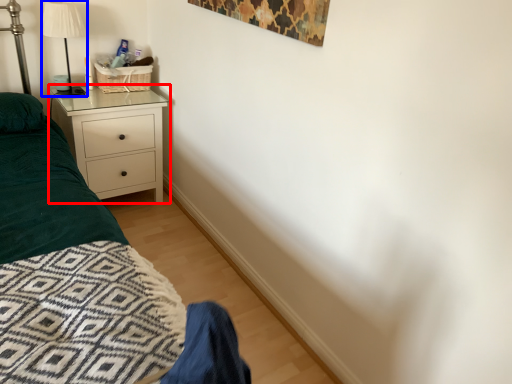
Question: Among these objects, which one is farthest to the camera, chest of drawers (highlighted by a red box) or lamp (highlighted by a blue box)?

Choices:
 (A) chest of drawers
 (B) lamp

Answer: (A)